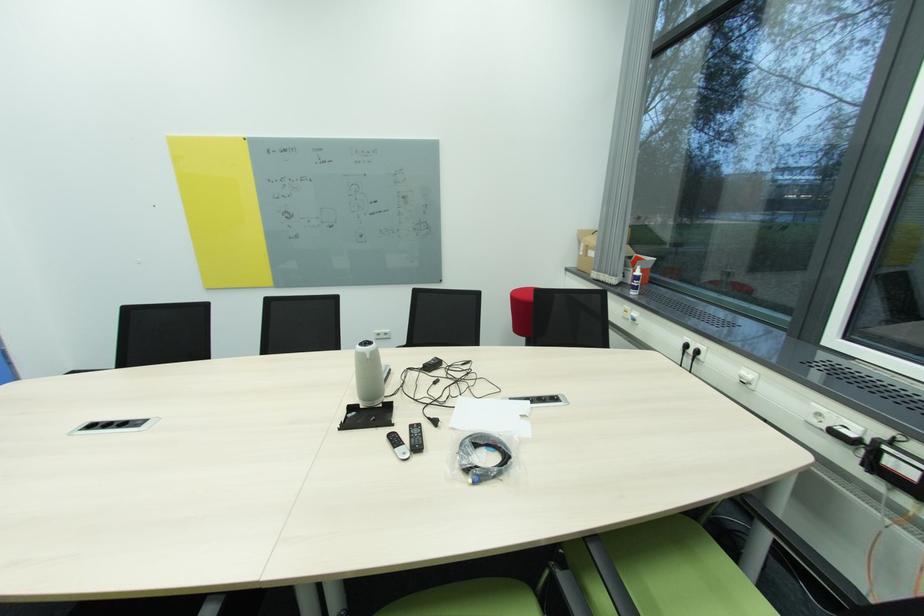
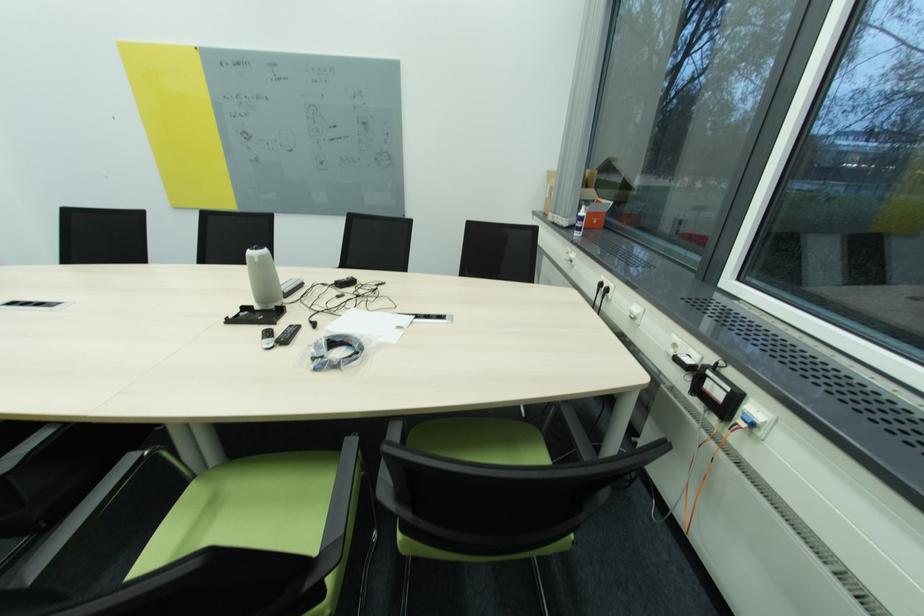
Find the pixel in the second image that matches point 701,353 in the first image.

(612, 291)